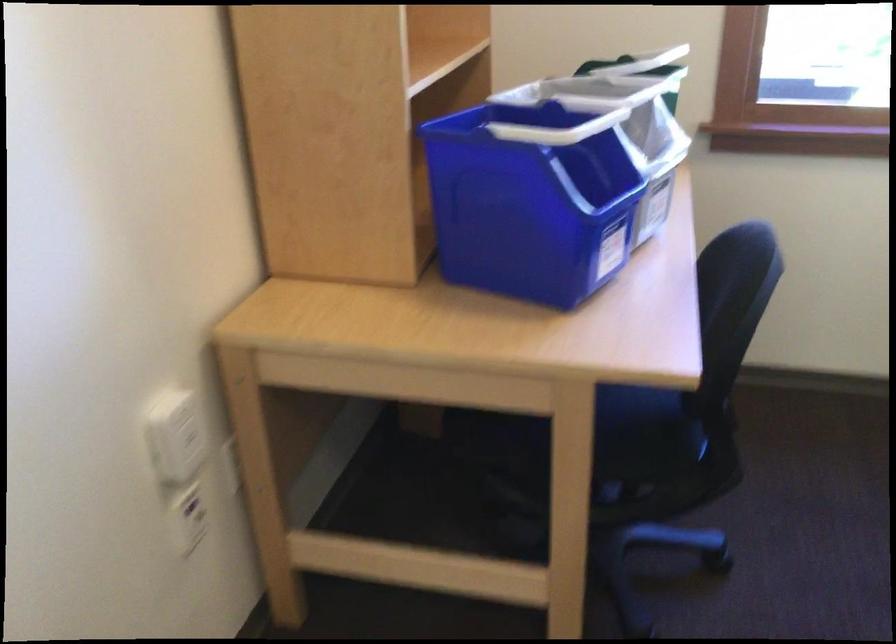
Identify the location of chair sitting surface. Image resolution: width=896 pixels, height=644 pixels. (633, 415).